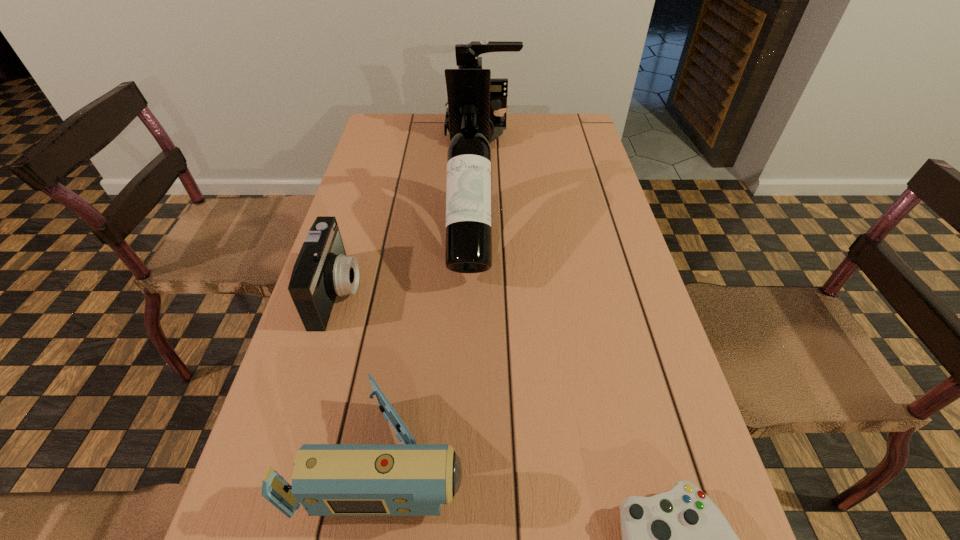
The image size is (960, 540). Find the location of `vacant space that satisfies the following two spatial constraints: 1. on the lens mount of the tallest camcorder; 2. on the stand of the tallest object`. vacant space that satisfies the following two spatial constraints: 1. on the lens mount of the tallest camcorder; 2. on the stand of the tallest object is located at coordinates (481, 237).